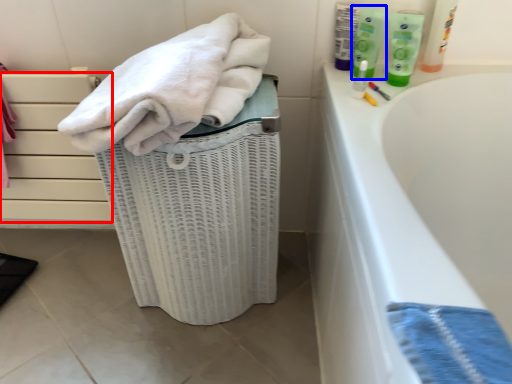
Question: Which object appears farthest to the camera in this image, drawer (highlighted by a red box) or cleaning product (highlighted by a blue box)?

Choices:
 (A) drawer
 (B) cleaning product

Answer: (A)